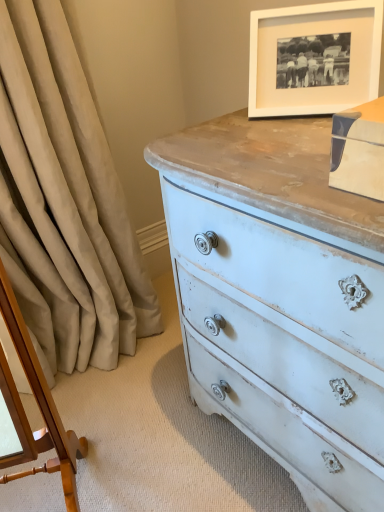
Question: Does white matte picture frame at upper right appear on the right side of beige fabric curtain at left?

Choices:
 (A) no
 (B) yes

Answer: (B)

Question: Does white matte picture frame at upper right have a greater height compared to beige fabric curtain at left?

Choices:
 (A) no
 (B) yes

Answer: (A)

Question: Considering the relative sizes of white matte picture frame at upper right and beige fabric curtain at left in the image provided, is white matte picture frame at upper right thinner than beige fabric curtain at left?

Choices:
 (A) no
 (B) yes

Answer: (B)

Question: Is the position of white matte picture frame at upper right more distant than that of beige fabric curtain at left?

Choices:
 (A) no
 (B) yes

Answer: (A)

Question: From the image's perspective, is white matte picture frame at upper right under beige fabric curtain at left?

Choices:
 (A) no
 (B) yes

Answer: (A)

Question: Is white matte picture frame at upper right beside beige fabric curtain at left?

Choices:
 (A) yes
 (B) no

Answer: (B)

Question: Does wooden changing table at left come behind beige fabric curtain at left?

Choices:
 (A) no
 (B) yes

Answer: (A)

Question: Is wooden changing table at left thinner than beige fabric curtain at left?

Choices:
 (A) no
 (B) yes

Answer: (B)

Question: Considering the relative sizes of wooden changing table at left and beige fabric curtain at left in the image provided, is wooden changing table at left wider than beige fabric curtain at left?

Choices:
 (A) no
 (B) yes

Answer: (A)

Question: Are wooden changing table at left and beige fabric curtain at left far apart?

Choices:
 (A) no
 (B) yes

Answer: (A)

Question: Is the depth of wooden changing table at left less than that of beige fabric curtain at left?

Choices:
 (A) yes
 (B) no

Answer: (A)

Question: Is wooden changing table at left at the left side of beige fabric curtain at left?

Choices:
 (A) yes
 (B) no

Answer: (A)

Question: From the image's perspective, is beige fabric curtain at left under wooden changing table at left?

Choices:
 (A) no
 (B) yes

Answer: (A)